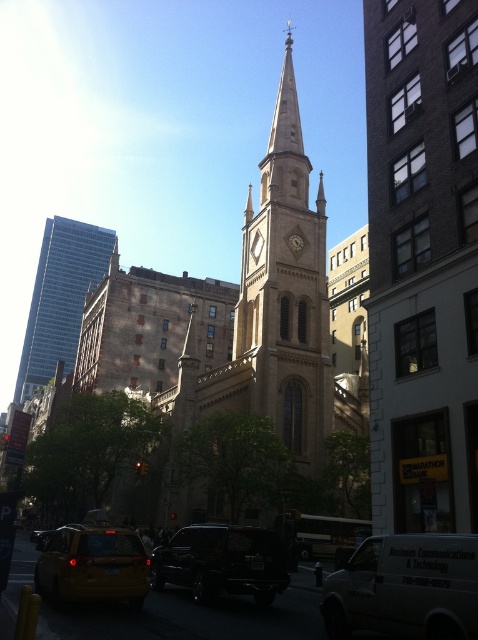
You are standing at the point marked by the coordinates point [221,563] in the image. What object are you standing on?

The point [221,563] indicates the shiny black suv at center, so you are standing on the shiny black suv at center.

You are a delivery driver needing to park your white matte van at center near the blue glass skyscraper at left. Given that the parking lot requires vehicles to be within 200 meters of the building, can you park your van in this location?

The white matte van at center is 192.46 meters away from the blue glass skyscraper at left, which is within the 200 meters requirement. Therefore, you can park the white matte van at center in this location.

You are a pedestrian standing on the sidewalk near the historic church. You see a white matte van at center and a yellow matte taxi at lower left. Which vehicle is closer to you?

The white matte van at center is closer to you because it is in front of the yellow matte taxi at lower left.